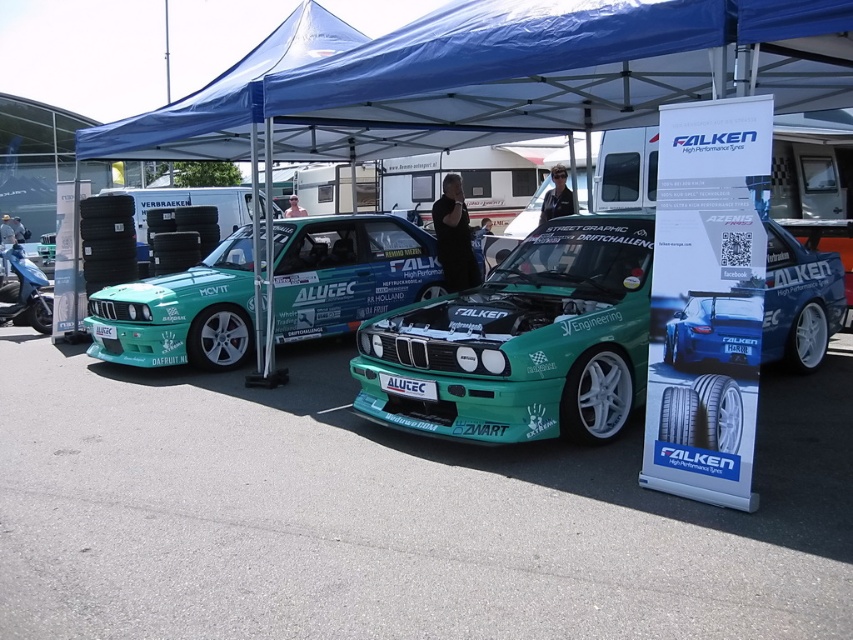
From the picture: Is blue metallic scooter at left below teal matte car at center?

Yes, blue metallic scooter at left is below teal matte car at center.

What do you see at coordinates (25, 292) in the screenshot?
I see `blue metallic scooter at left` at bounding box center [25, 292].

This screenshot has width=853, height=640. What do you see at coordinates (25, 292) in the screenshot?
I see `blue metallic scooter at left` at bounding box center [25, 292].

Find the location of a particular element. The height and width of the screenshot is (640, 853). blue metallic scooter at left is located at coordinates (25, 292).

Between point (611, 128) and point (212, 305), which one is positioned behind?

Positioned behind is point (611, 128).

Which is more to the left, blue fabric canopy at upper center or teal glossy car at center?

teal glossy car at center is more to the left.

Does point (758, 52) lie in front of point (416, 230)?

Yes, point (758, 52) is closer to viewer.

Locate an element on the screen. blue fabric canopy at upper center is located at coordinates (492, 76).

In the scene shown: Does green matte car at center appear on the left side of teal glossy car at center?

Incorrect, green matte car at center is not on the left side of teal glossy car at center.

Does green matte car at center have a larger size compared to teal glossy car at center?

Correct, green matte car at center is larger in size than teal glossy car at center.

Is point (622, 285) closer to camera compared to point (321, 332)?

Yes, point (622, 285) is in front of point (321, 332).

You are a GUI agent. You are given a task and a screenshot of the screen. Output one action in this format:
    pyautogui.click(x=<x>, y=<y>)
    Task: Click on the green matte car at center
    
    Given the screenshot: What is the action you would take?
    pyautogui.click(x=521, y=340)